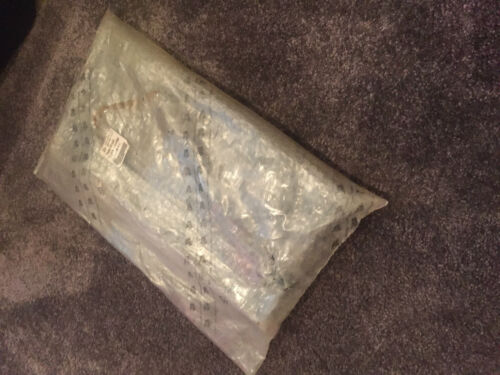
At what (x,y) coordinates should I click in order to perform the action: click on carpet. Please return your answer as a coordinate pair (x, y). Image resolution: width=500 pixels, height=375 pixels. Looking at the image, I should click on (419, 141).